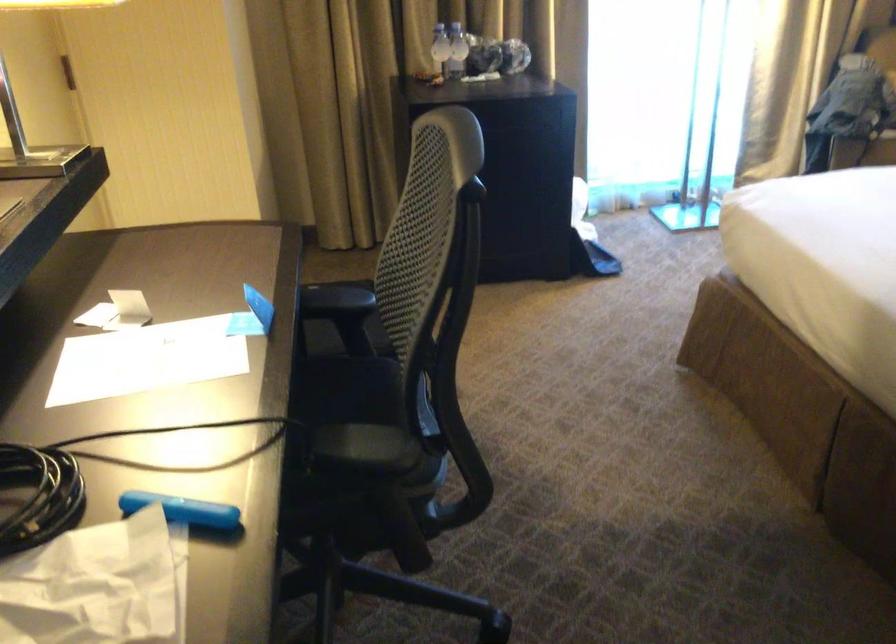
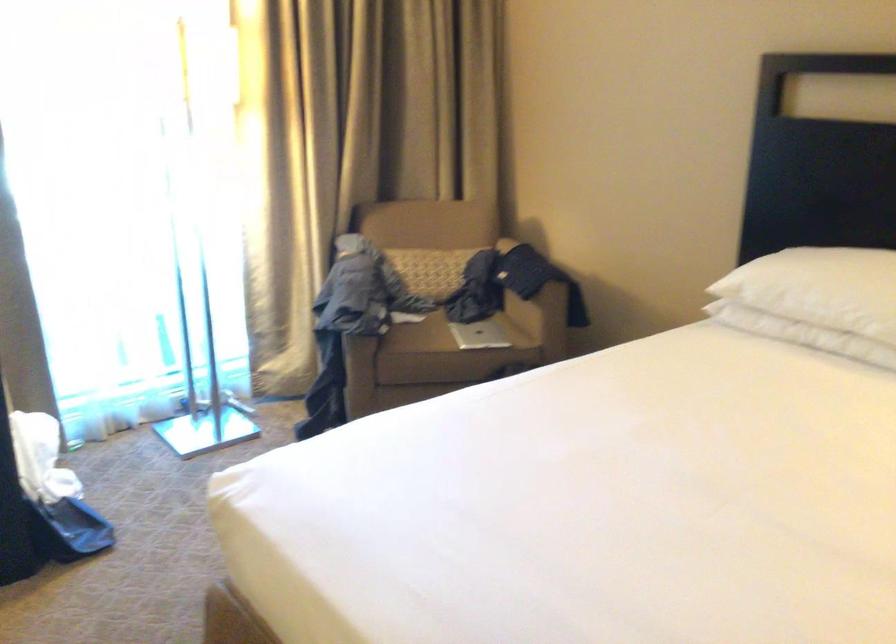
Question: The images are taken continuously from a first-person perspective. In which direction is your viewpoint rotating?

Choices:
 (A) Left
 (B) Right
 (C) Up
 (D) Down

Answer: (B)